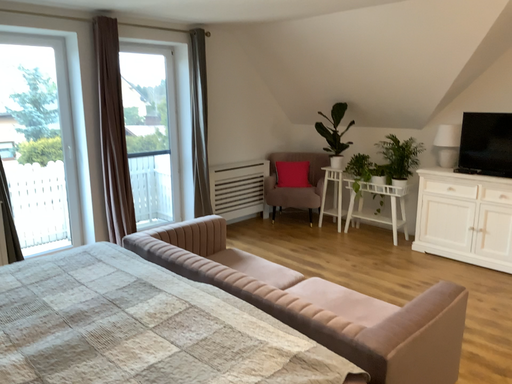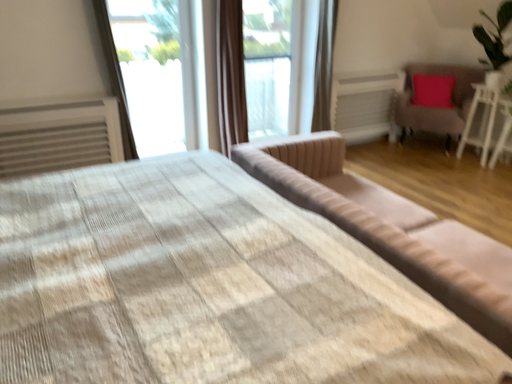
Question: How did the camera likely rotate when shooting the video?

Choices:
 (A) rotated left
 (B) rotated right

Answer: (A)